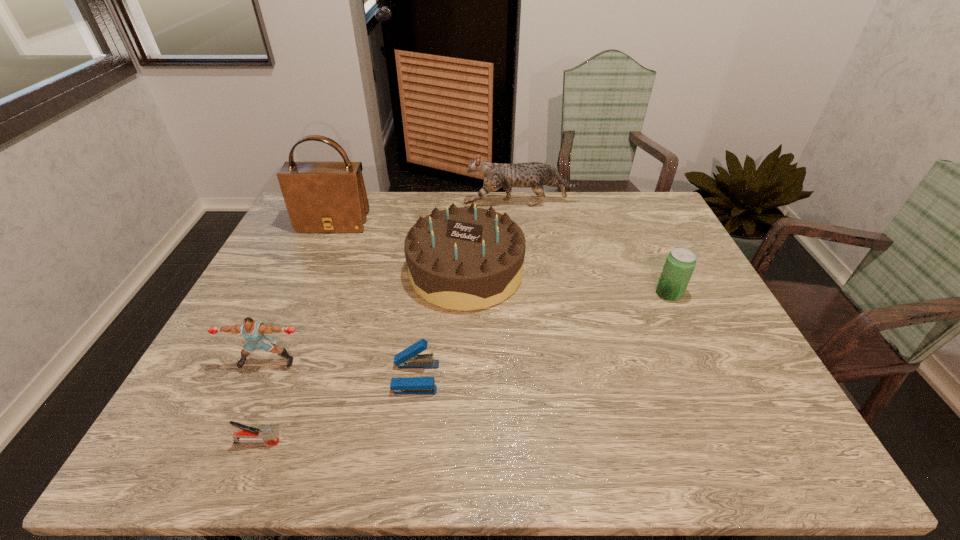
Identify the location of object present at the near edge. Image resolution: width=960 pixels, height=540 pixels. (248, 435).

Where is `shoulder bag at the left edge`? Image resolution: width=960 pixels, height=540 pixels. shoulder bag at the left edge is located at coordinates (320, 196).

Locate an element on the screen. This screenshot has height=540, width=960. puncher located at the left edge is located at coordinates (253, 331).

Locate an element on the screen. The width and height of the screenshot is (960, 540). stapler located in the left edge section of the desktop is located at coordinates (248, 435).

I want to click on object present at the right edge, so click(680, 263).

I want to click on object that is at the far left corner, so click(x=320, y=196).

You are a GUI agent. You are given a task and a screenshot of the screen. Output one action in this format:
    pyautogui.click(x=<x>, y=<y>)
    Task: Click on the object present at the near left corner
    
    Given the screenshot: What is the action you would take?
    pyautogui.click(x=248, y=435)

Locate an element on the screen. free space at the far edge is located at coordinates (564, 204).

Find the location of a particular element. vacant space at the near edge of the desktop is located at coordinates (656, 435).

Find the location of a particular element. The width and height of the screenshot is (960, 540). blank area at the left edge is located at coordinates click(271, 320).